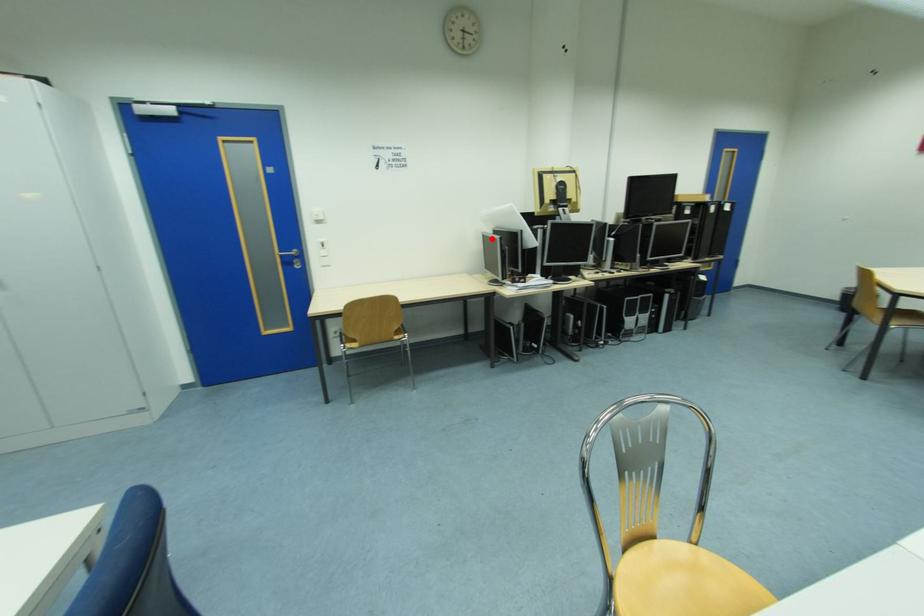
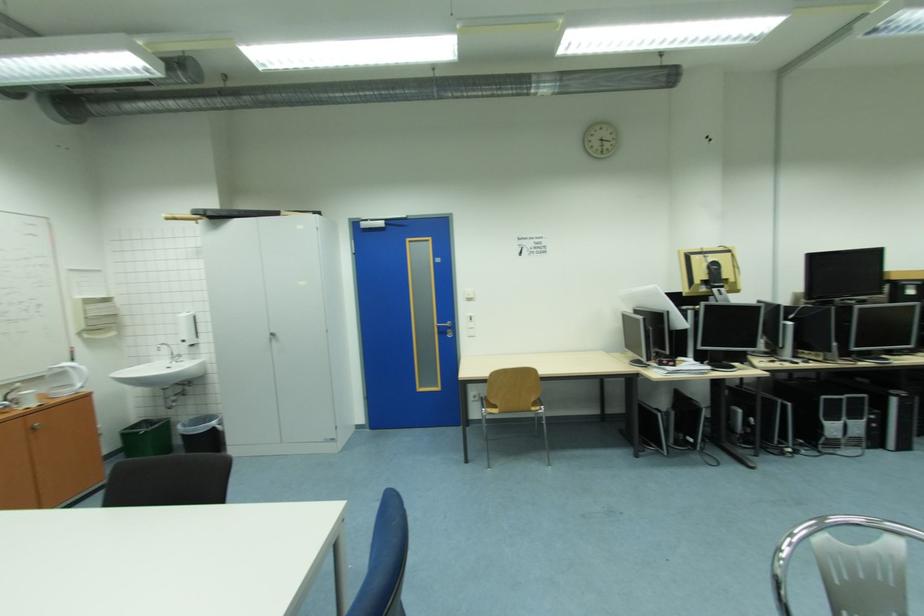
In the second image, find the point that corresponds to the highlighted location in the first image.

(631, 318)